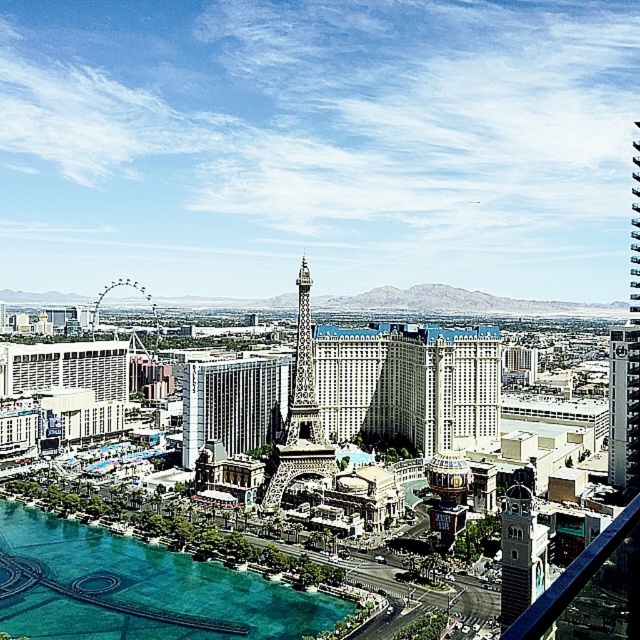
Who is shorter, shiny metallic eiffel tower at center or brick tower at center?

Standing shorter between the two is brick tower at center.

Is shiny metallic eiffel tower at center bigger than brick tower at center?

Indeed, shiny metallic eiffel tower at center has a larger size compared to brick tower at center.

The height and width of the screenshot is (640, 640). Describe the element at coordinates (300, 413) in the screenshot. I see `shiny metallic eiffel tower at center` at that location.

You are a GUI agent. You are given a task and a screenshot of the screen. Output one action in this format:
    pyautogui.click(x=<x>, y=<y>)
    Task: Click on the shiny metallic eiffel tower at center
    Image resolution: width=640 pixels, height=640 pixels.
    Given the screenshot: What is the action you would take?
    pyautogui.click(x=300, y=413)

Is brick tower at center positioned behind metallic silver parking garage at right?

No, brick tower at center is closer to the viewer.

How distant is brick tower at center from metallic silver parking garage at right?

63.41 meters

The image size is (640, 640). I want to click on brick tower at center, so click(520, 554).

Identify the location of brick tower at center. (520, 554).

Which is in front, point (460, 436) or point (628, 403)?

Point (628, 403) is in front.

Between white glossy hotel at center and metallic silver parking garage at right, which one is positioned lower?

metallic silver parking garage at right is below.

Is point (483, 362) more distant than point (634, 380)?

Yes, it is.

At what (x,y) coordinates should I click in order to perform the action: click on white glossy hotel at center. Please return your answer as a coordinate pair (x, y). Image resolution: width=640 pixels, height=640 pixels. Looking at the image, I should click on [474, 388].